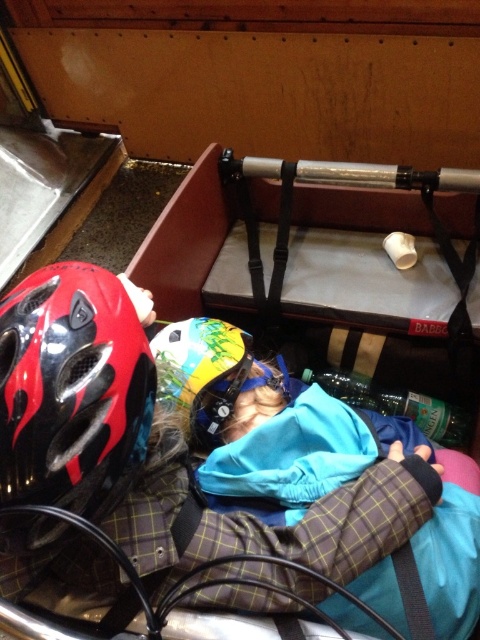
Question: Considering the real-world distances, which object is farthest from the plaid fabric sleeping bag at center?

Choices:
 (A) multicolored glossy helmet at center
 (B) shiny red helmet at left

Answer: (B)

Question: Does shiny red helmet at left have a greater width compared to multicolored glossy helmet at center?

Choices:
 (A) yes
 (B) no

Answer: (A)

Question: Is plaid fabric sleeping bag at center to the right of shiny red helmet at left from the viewer's perspective?

Choices:
 (A) yes
 (B) no

Answer: (A)

Question: Can you confirm if shiny red helmet at left is positioned to the right of multicolored glossy helmet at center?

Choices:
 (A) no
 (B) yes

Answer: (A)

Question: Based on their relative distances, which object is nearer to the plaid fabric sleeping bag at center?

Choices:
 (A) shiny red helmet at left
 (B) multicolored glossy helmet at center

Answer: (B)

Question: Which of these objects is positioned farthest from the shiny red helmet at left?

Choices:
 (A) multicolored glossy helmet at center
 (B) plaid fabric sleeping bag at center

Answer: (B)